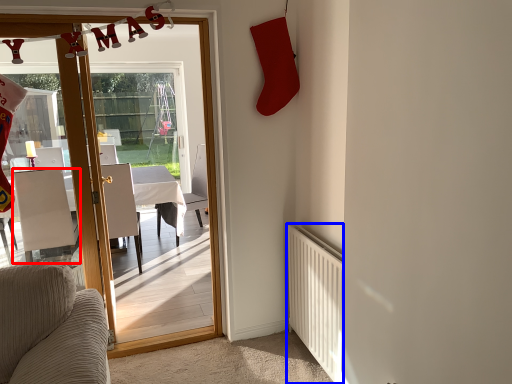
Question: Among these objects, which one is nearest to the camera, chair (highlighted by a red box) or radiator (highlighted by a blue box)?

Choices:
 (A) chair
 (B) radiator

Answer: (B)